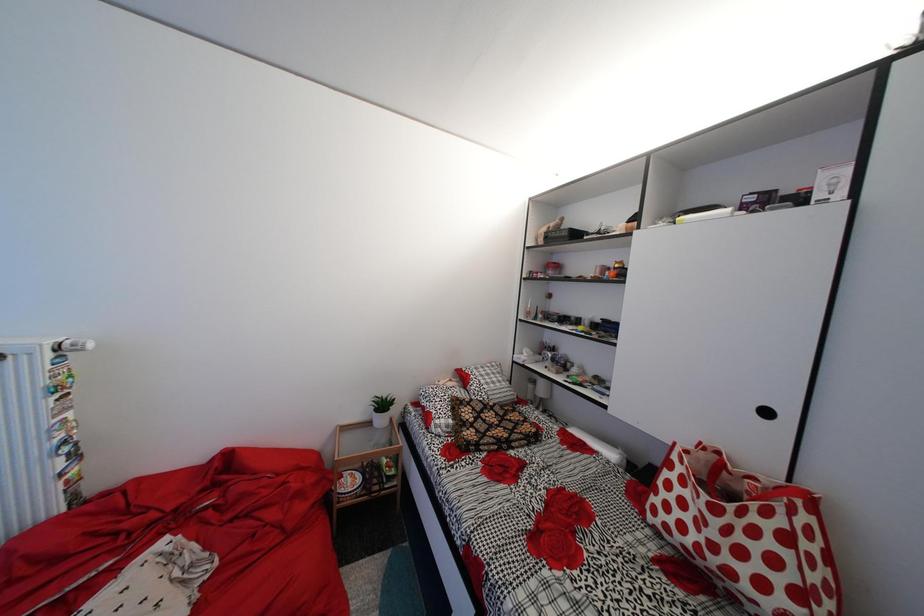
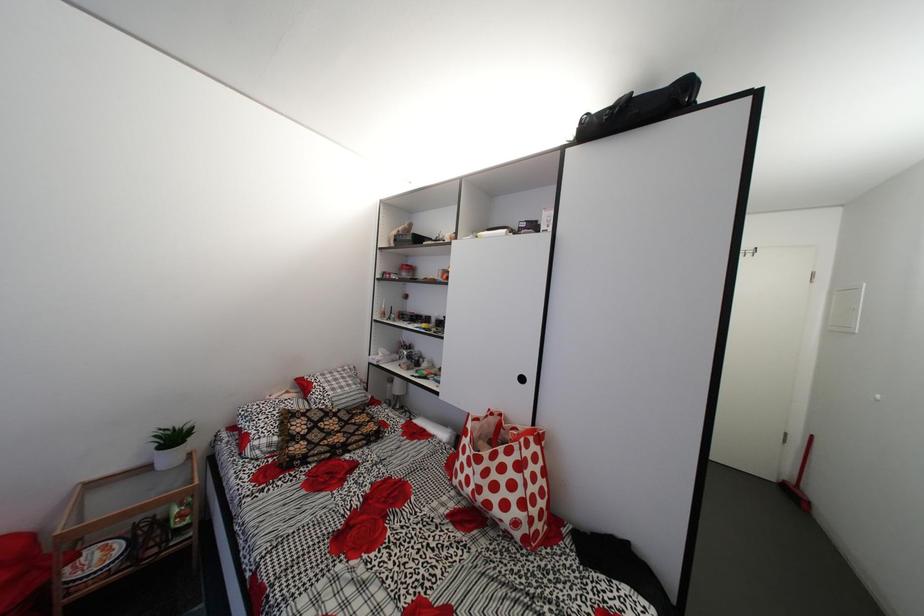
Question: Based on the continuous images, in which direction is the camera rotating? Reply with the corresponding letter.

Choices:
 (A) Left
 (B) Right
 (C) Up
 (D) Down

Answer: (B)